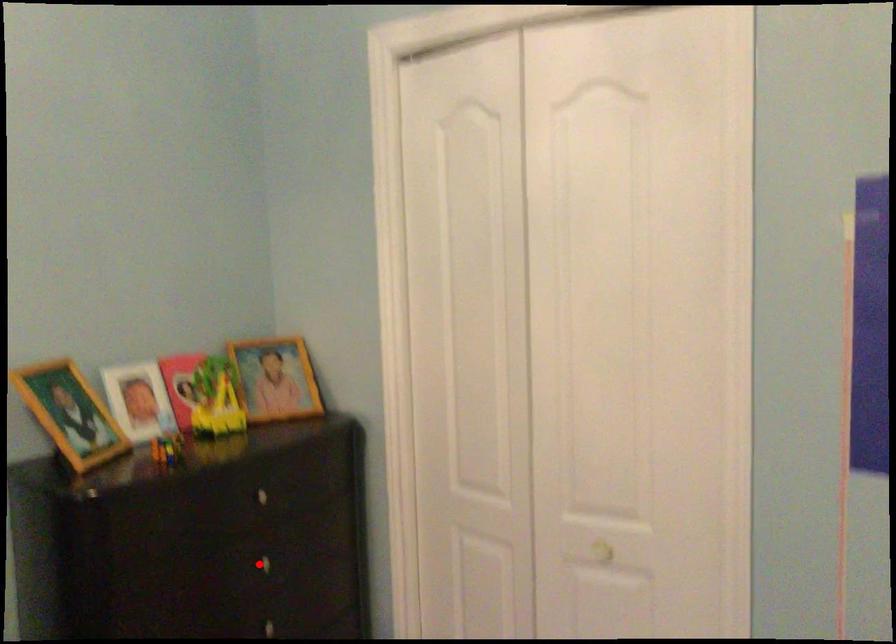
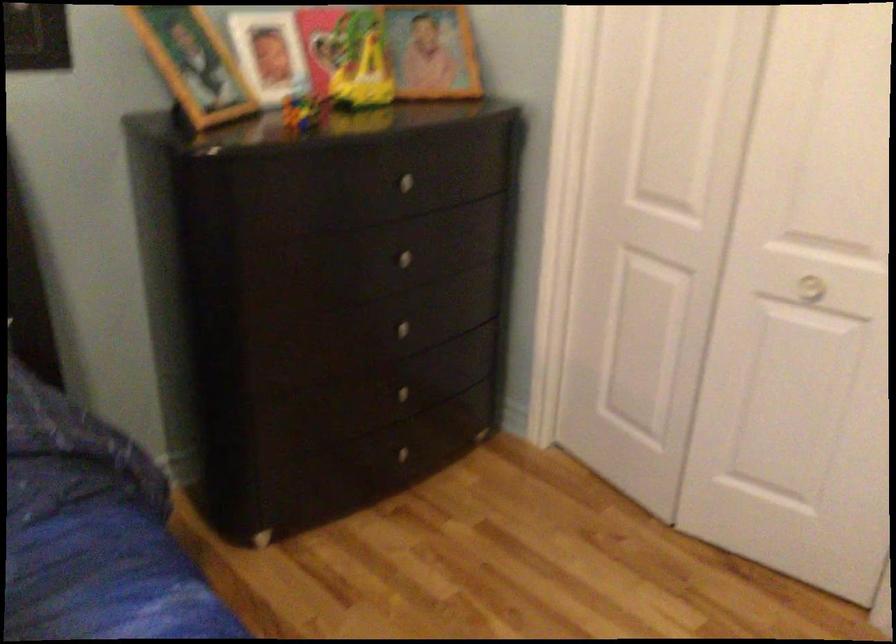
Question: I am providing you with two images of the same scene from different viewpoints. In image1, a red point is highlighted. Considering the same 3D point in image2, which of the following is correct?

Choices:
 (A) It is closer
 (B) It is farther

Answer: (A)